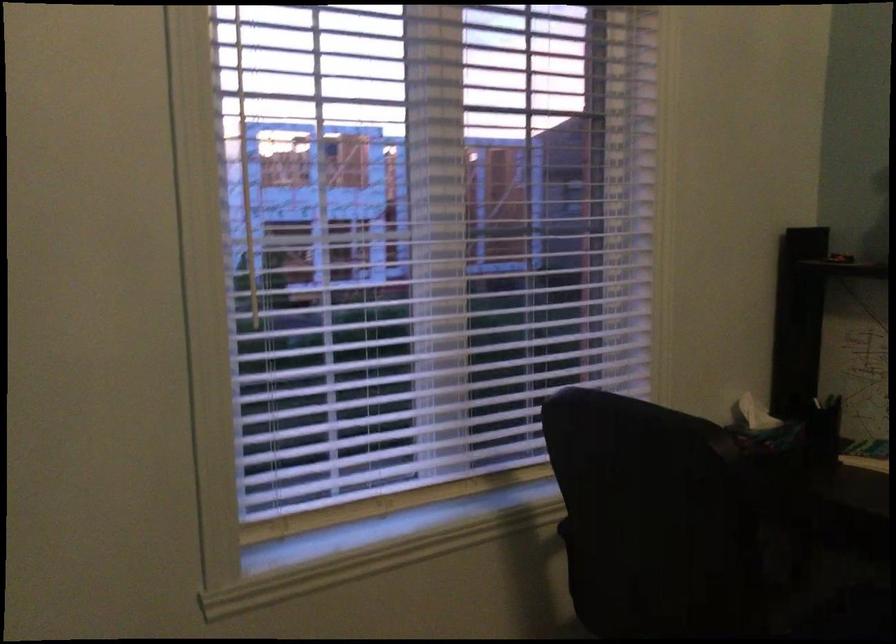
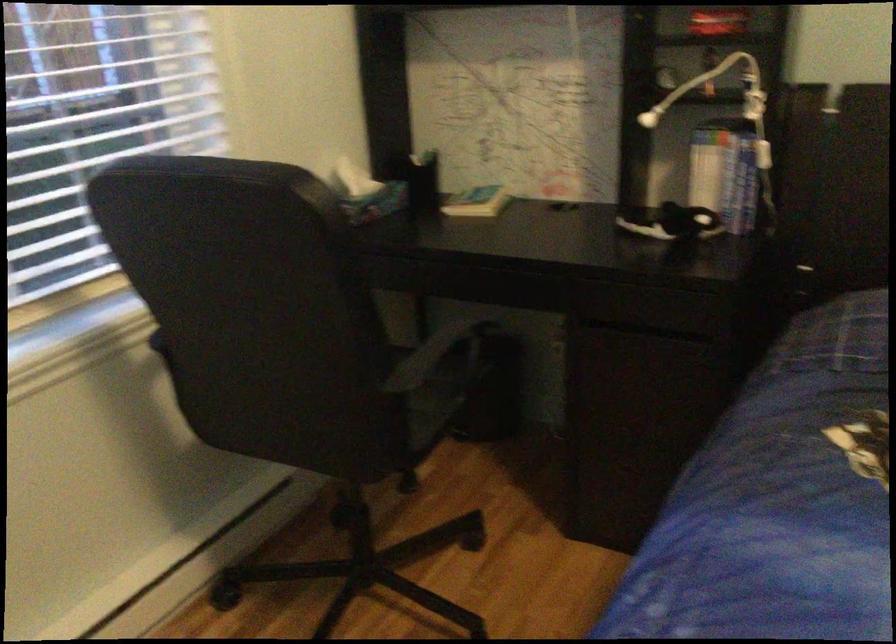
First-person continuous shooting, in which direction is the camera rotating?

The camera rotated toward right-down.